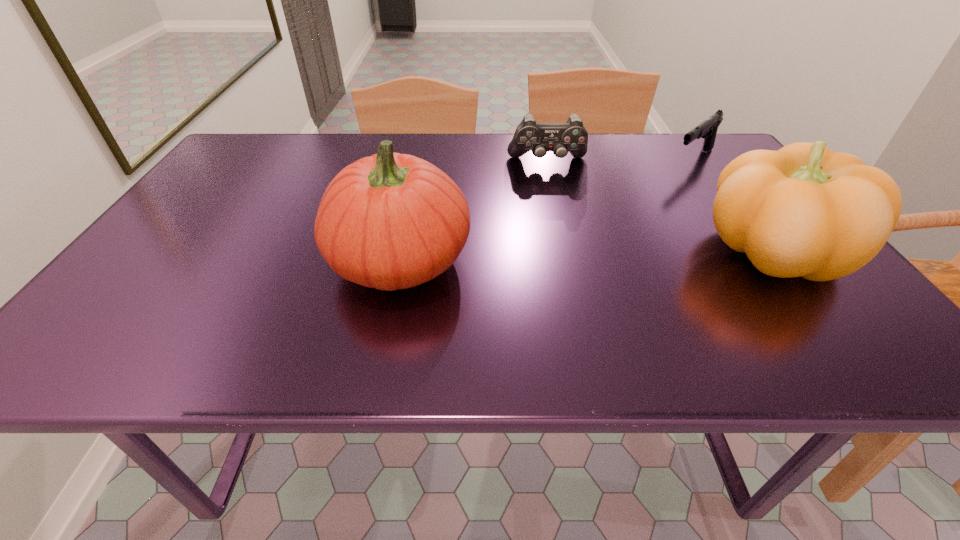
Where is `vacant space on the desktop that is between the leftmost object and the right pumpkin and is positioned at the aiming end of the gun`? vacant space on the desktop that is between the leftmost object and the right pumpkin and is positioned at the aiming end of the gun is located at coordinates (573, 255).

I want to click on vacant space on the desktop that is between the leftmost object and the right pumpkin and is positioned on the surface of the second object from left to right with buttons, so pyautogui.click(x=566, y=256).